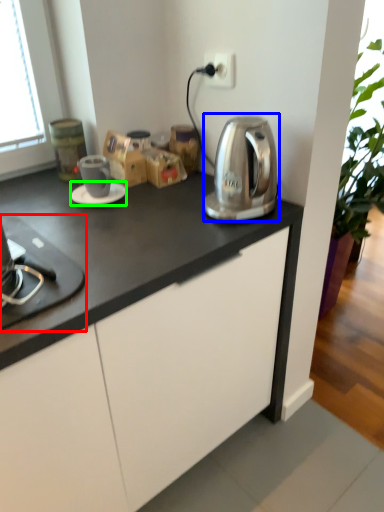
Question: Estimate the real-world distances between objects in this image. Which object is closer to home appliance (highlighted by a red box), kitchen appliance (highlighted by a blue box) or saucer (highlighted by a green box)?

Choices:
 (A) kitchen appliance
 (B) saucer

Answer: (B)